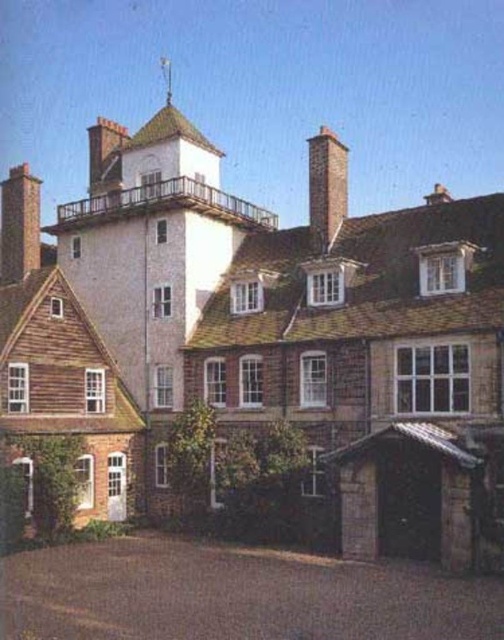
Question: Considering the real-world distances, which object is farthest from the smooth brick chimney at upper center?

Choices:
 (A) red brick chimney at upper right
 (B) brick chimney at left

Answer: (A)

Question: Estimate the real-world distances between objects in this image. Which object is farther from the smooth brick chimney at upper center?

Choices:
 (A) brick chimney at left
 (B) red brick chimney at upper right

Answer: (B)

Question: Where is red brick chimney at upper right located in relation to smooth brick chimney at upper center in the image?

Choices:
 (A) left
 (B) right

Answer: (B)

Question: Among these points, which one is nearest to the camera?

Choices:
 (A) tap(120, 186)
 (B) tap(331, 157)

Answer: (B)

Question: Where is brick chimney at left located in relation to smooth brick chimney at upper center in the image?

Choices:
 (A) above
 (B) below

Answer: (B)

Question: Observing the image, what is the correct spatial positioning of brick chimney at left in reference to smooth brick chimney at upper center?

Choices:
 (A) right
 (B) left

Answer: (B)